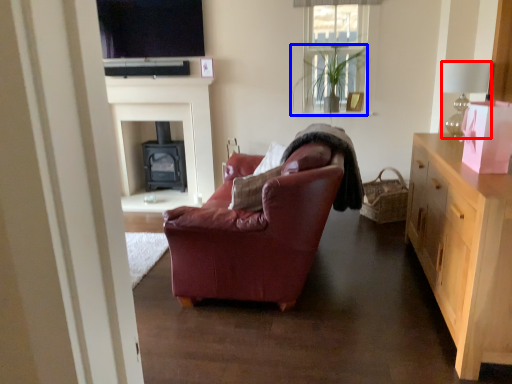
Question: Among these objects, which one is farthest to the camera, lamp (highlighted by a red box) or houseplant (highlighted by a blue box)?

Choices:
 (A) lamp
 (B) houseplant

Answer: (B)